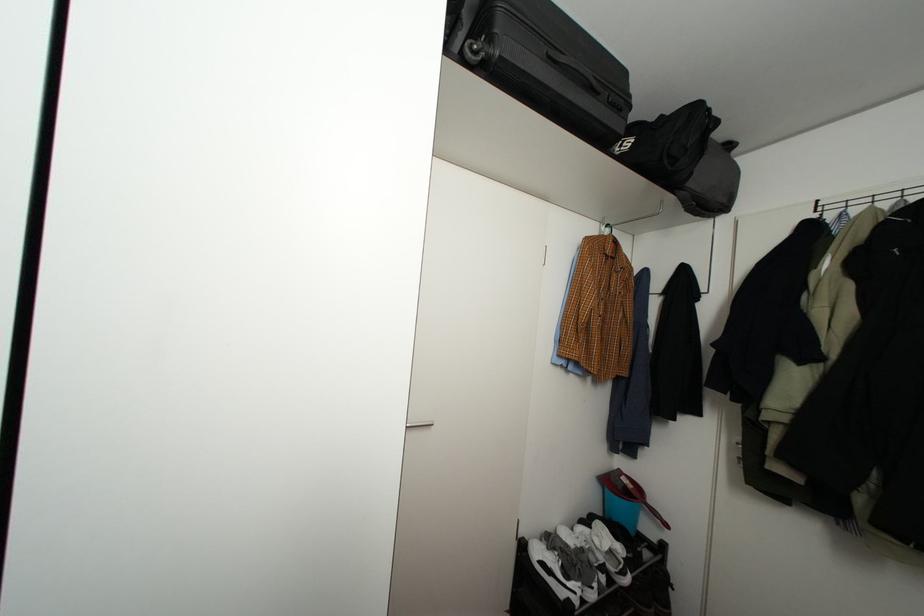
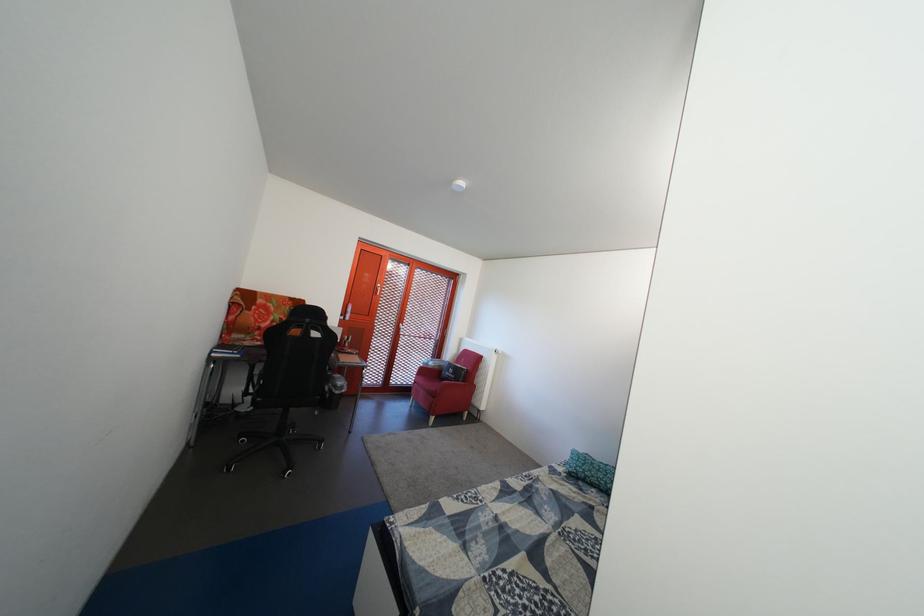
Question: Based on the continuous images, in which direction is the camera rotating? Reply with the corresponding letter.

Choices:
 (A) Left
 (B) Right
 (C) Up
 (D) Down

Answer: (A)